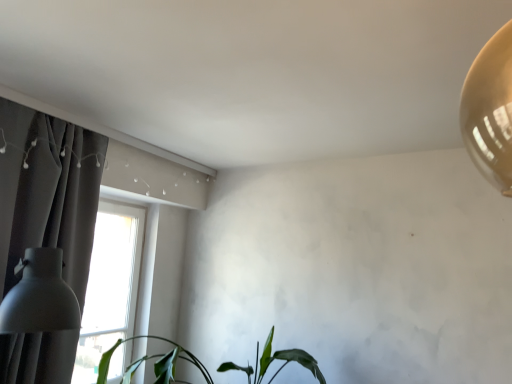
Question: Does dark gray fabric curtain at left have a larger size compared to matte white lampshade at left?

Choices:
 (A) yes
 (B) no

Answer: (A)

Question: Would you say matte white lampshade at left is part of dark gray fabric curtain at left's contents?

Choices:
 (A) no
 (B) yes

Answer: (B)

Question: Is dark gray fabric curtain at left thinner than matte white lampshade at left?

Choices:
 (A) yes
 (B) no

Answer: (A)

Question: From a real-world perspective, is dark gray fabric curtain at left physically above matte white lampshade at left?

Choices:
 (A) yes
 (B) no

Answer: (A)

Question: Can we say dark gray fabric curtain at left lies outside matte white lampshade at left?

Choices:
 (A) yes
 (B) no

Answer: (A)

Question: Looking at their shapes, would you say matte white lampshade at left is wider or thinner than dark gray fabric curtain at left?

Choices:
 (A) thin
 (B) wide

Answer: (B)

Question: From the image's perspective, is matte white lampshade at left located above or below dark gray fabric curtain at left?

Choices:
 (A) below
 (B) above

Answer: (A)

Question: Looking at the image, does matte white lampshade at left seem bigger or smaller compared to dark gray fabric curtain at left?

Choices:
 (A) big
 (B) small

Answer: (B)

Question: Which is correct: matte white lampshade at left is inside dark gray fabric curtain at left, or outside of it?

Choices:
 (A) inside
 (B) outside

Answer: (A)

Question: Is point (79, 198) positioned closer to the camera than point (41, 273)?

Choices:
 (A) farther
 (B) closer

Answer: (A)

Question: From a real-world perspective, is dark gray fabric curtain at left physically located above or below matte white lampshade at left?

Choices:
 (A) above
 (B) below

Answer: (A)

Question: In the image, is dark gray fabric curtain at left positioned in front of or behind matte white lampshade at left?

Choices:
 (A) behind
 (B) front

Answer: (A)

Question: From the image's perspective, is dark gray fabric curtain at left above or below matte white lampshade at left?

Choices:
 (A) below
 (B) above

Answer: (B)

Question: From a real-world perspective, is green matte plant at lower center physically located above or below dark gray fabric curtain at left?

Choices:
 (A) above
 (B) below

Answer: (B)

Question: In terms of height, does green matte plant at lower center look taller or shorter compared to dark gray fabric curtain at left?

Choices:
 (A) tall
 (B) short

Answer: (B)